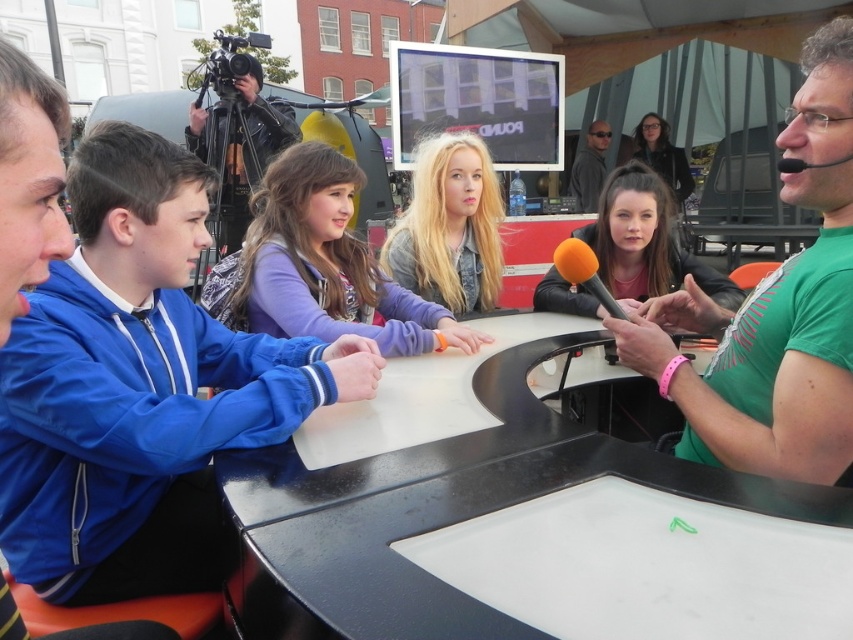
Which is below, blonde hair at center or black matte microphone at upper right?

black matte microphone at upper right is below.

Which is in front, point (421, 195) or point (778, 161)?

Point (778, 161)

Find the location of a particular element. The width and height of the screenshot is (853, 640). blonde hair at center is located at coordinates (450, 227).

Is blonde hair at center closer to the viewer compared to matte black jacket at center?

No, blonde hair at center is further to the viewer.

Does blonde hair at center have a smaller size compared to matte black jacket at center?

Correct, blonde hair at center occupies less space than matte black jacket at center.

Image resolution: width=853 pixels, height=640 pixels. Identify the location of blonde hair at center. click(x=450, y=227).

Can you confirm if black glossy round table at center is bigger than orange foam microphone at center?

Correct, black glossy round table at center is larger in size than orange foam microphone at center.

Does black glossy round table at center appear on the left side of orange foam microphone at center?

Yes, black glossy round table at center is to the left of orange foam microphone at center.

This screenshot has height=640, width=853. What do you see at coordinates (524, 524) in the screenshot? I see `black glossy round table at center` at bounding box center [524, 524].

Image resolution: width=853 pixels, height=640 pixels. Find the location of `black glossy round table at center`. black glossy round table at center is located at coordinates (524, 524).